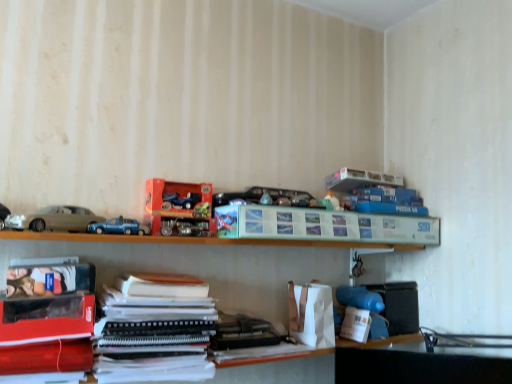
Where is `blank space situated above matte black paperback book at lower left, acting as the 2th paperback book starting from the back (from a real-world perspective)`? blank space situated above matte black paperback book at lower left, acting as the 2th paperback book starting from the back (from a real-world perspective) is located at coordinates (41, 296).